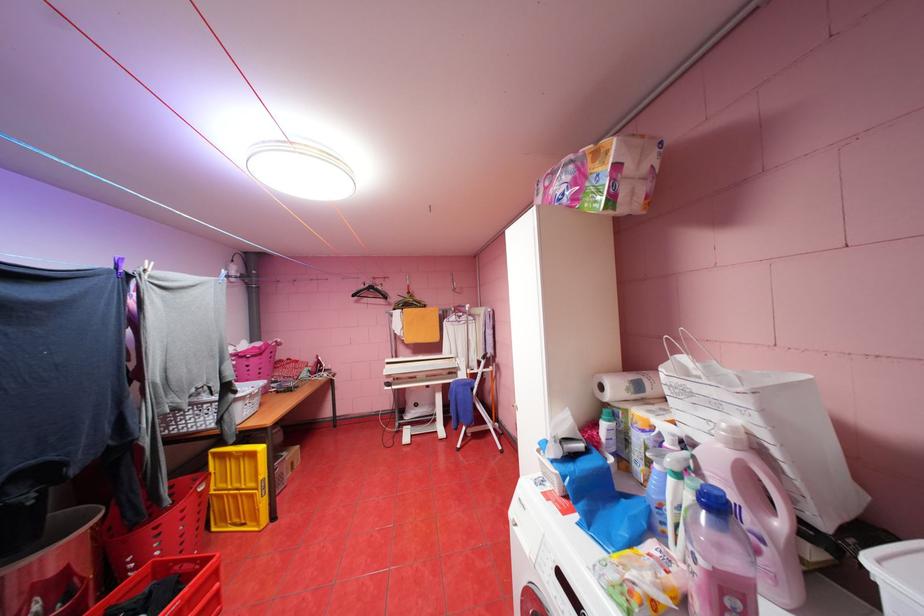
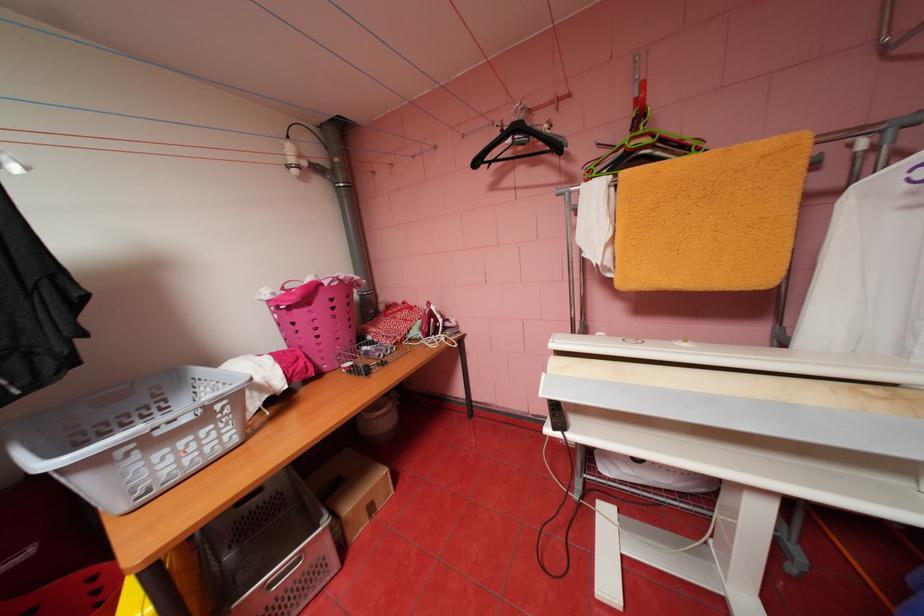
In the second image, find the point that corresponds to the point at 361,294 in the first image.

(484, 163)